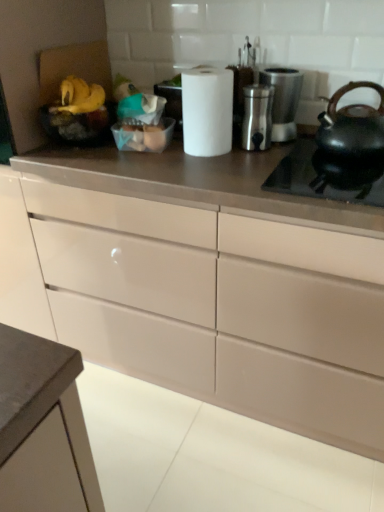
You are a GUI agent. You are given a task and a screenshot of the screen. Output one action in this format:
    pyautogui.click(x=<x>, y=<y>)
    Task: Click on the free space to the left of matte black kettle at right
    This screenshot has height=512, width=384.
    Given the screenshot: What is the action you would take?
    pyautogui.click(x=289, y=158)